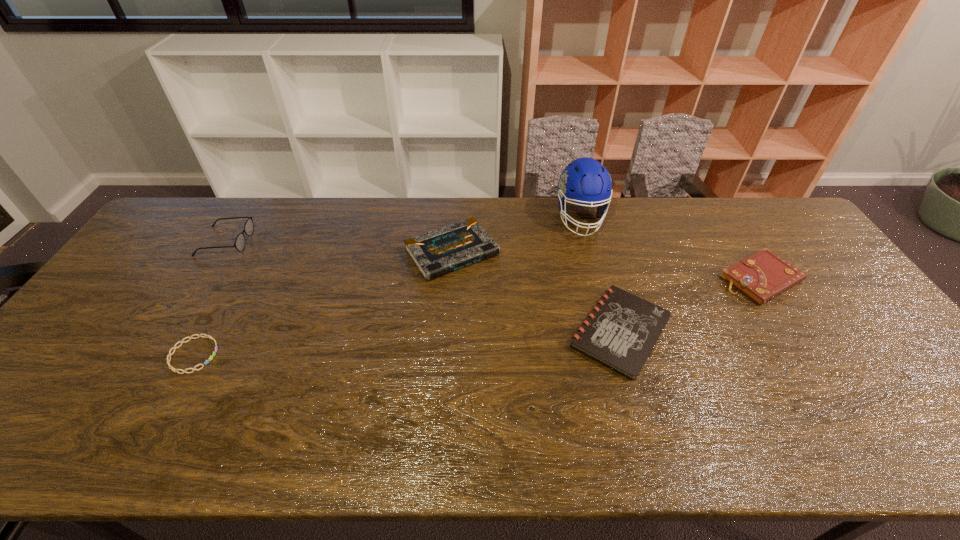
Where is `free space between the third object from left to right and the bracelet`? The image size is (960, 540). free space between the third object from left to right and the bracelet is located at coordinates (323, 303).

Find the location of a particular element. The height and width of the screenshot is (540, 960). free spot between the rightmost notebook and the second tallest object is located at coordinates (493, 260).

This screenshot has height=540, width=960. Identify the location of object that stands as the fifth closest to the spectacles. (764, 275).

Select which object appears as the second closest to the second tallest object. Please provide its 2D coordinates. Your answer should be formatted as a tuple, i.e. [(x, y)], where the tuple contains the x and y coordinates of a point satisfying the conditions above.

[(436, 253)]

Identify the location of the second closest notebook to the rightmost notebook. Image resolution: width=960 pixels, height=540 pixels. (436, 253).

You are a GUI agent. You are given a task and a screenshot of the screen. Output one action in this format:
    pyautogui.click(x=<x>, y=<y>)
    Task: Click on the second closest notebook relative to the rightmost object
    The image size is (960, 540).
    Given the screenshot: What is the action you would take?
    pyautogui.click(x=436, y=253)

The width and height of the screenshot is (960, 540). Identify the location of vacant position in the image that satisfies the following two spatial constraints: 1. on the front-facing side of the fifth shortest object; 2. on the left side of the rightmost object. (203, 279).

Where is `free space that satisfies the following two spatial constraints: 1. on the face guard of the tallest object; 2. on the front-facing side of the fifth shortest object`? Image resolution: width=960 pixels, height=540 pixels. free space that satisfies the following two spatial constraints: 1. on the face guard of the tallest object; 2. on the front-facing side of the fifth shortest object is located at coordinates (587, 241).

Identify the location of vacant area that satisfies the following two spatial constraints: 1. on the front side of the third object from left to right; 2. on the surface of the shortest object showing star-shaped elements. The image size is (960, 540). coord(445,355).

Locate an element on the screen. The image size is (960, 540). blank space that satisfies the following two spatial constraints: 1. on the front side of the third object from left to right; 2. on the surface of the bracelet showing star-shaped elements is located at coordinates (445, 355).